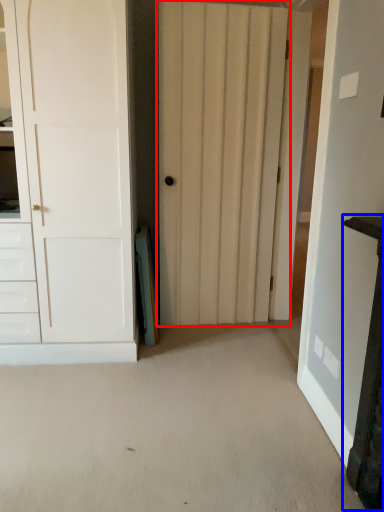
Question: Which object appears farthest to the camera in this image, door (highlighted by a red box) or vanity (highlighted by a blue box)?

Choices:
 (A) door
 (B) vanity

Answer: (A)